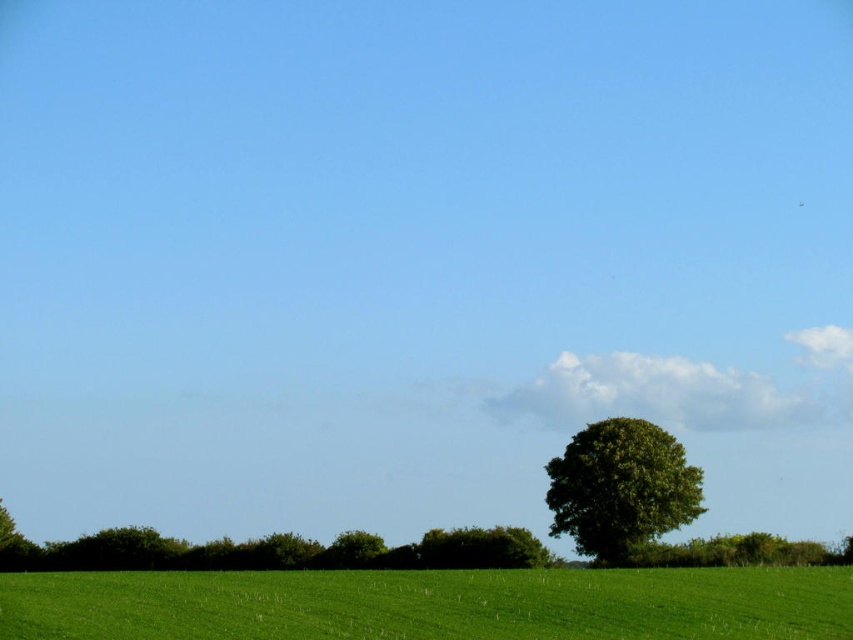
You are a drone operator flying a drone over the serene rural landscape. You need to land your drone on the green grassy field at lower center. According to the coordinates provided, where should you aim to land the drone?

The green grassy field at lower center is located at coordinates point (x=431, y=604), so you should aim to land the drone there.

You are standing in the middle of the field looking towards the tree. There are two points marked in the image. Which point, point (537, 592) or point (692, 500), is closer to you?

Point (537, 592) is closer to the viewer than point (692, 500).